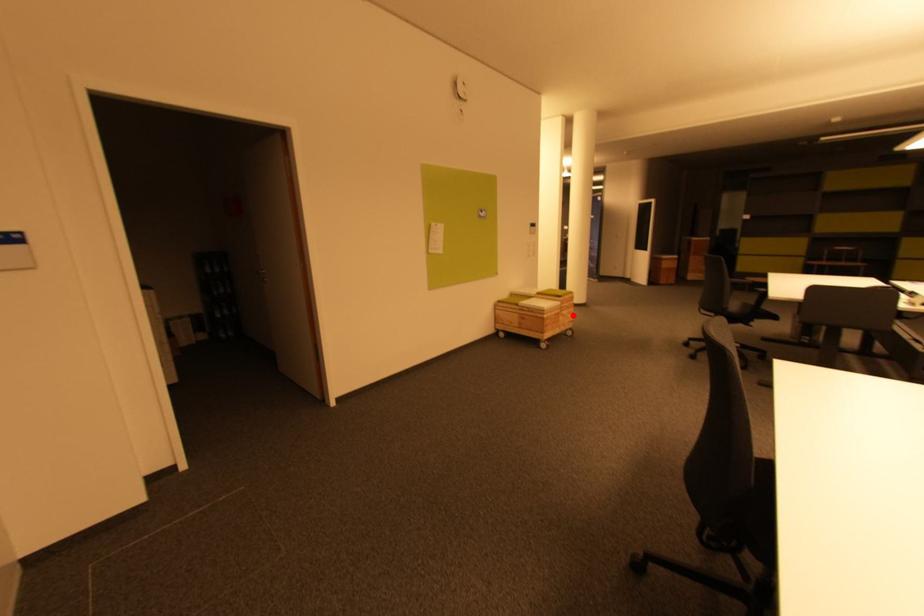
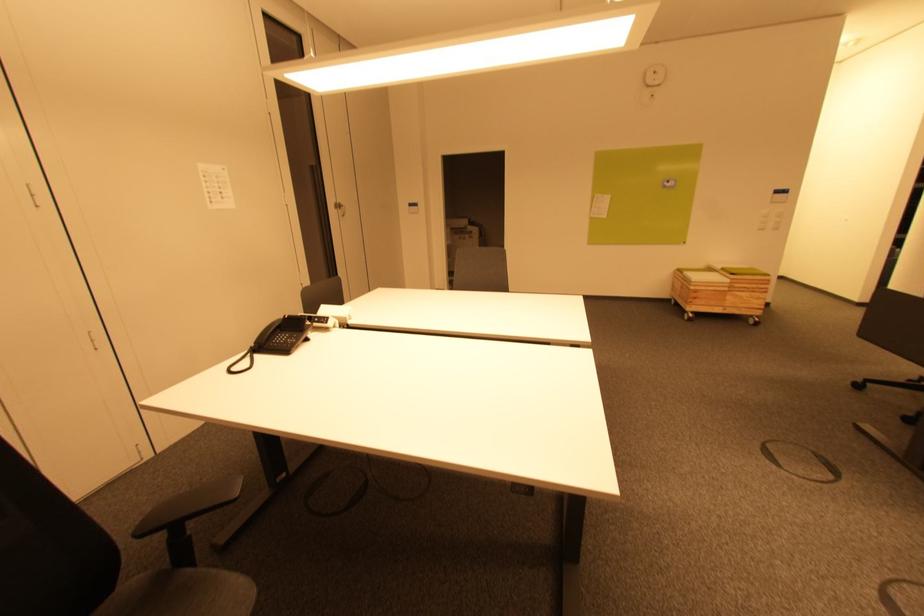
Question: I am providing you with two images of the same scene from different viewpoints. Given a red point in image1, look at the same physical point in image2. Is it:

Choices:
 (A) Closer to the viewpoint
 (B) Farther from the viewpoint

Answer: (A)